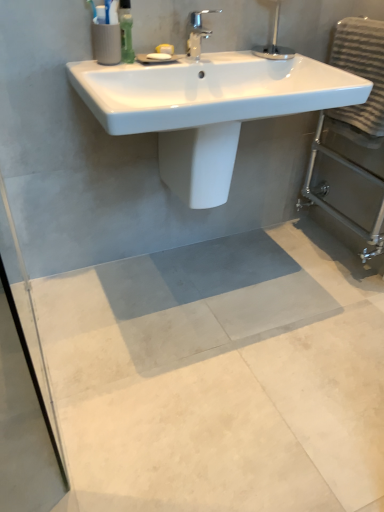
I want to click on empty space that is ontop of gray concrete mat at center, so click(236, 351).